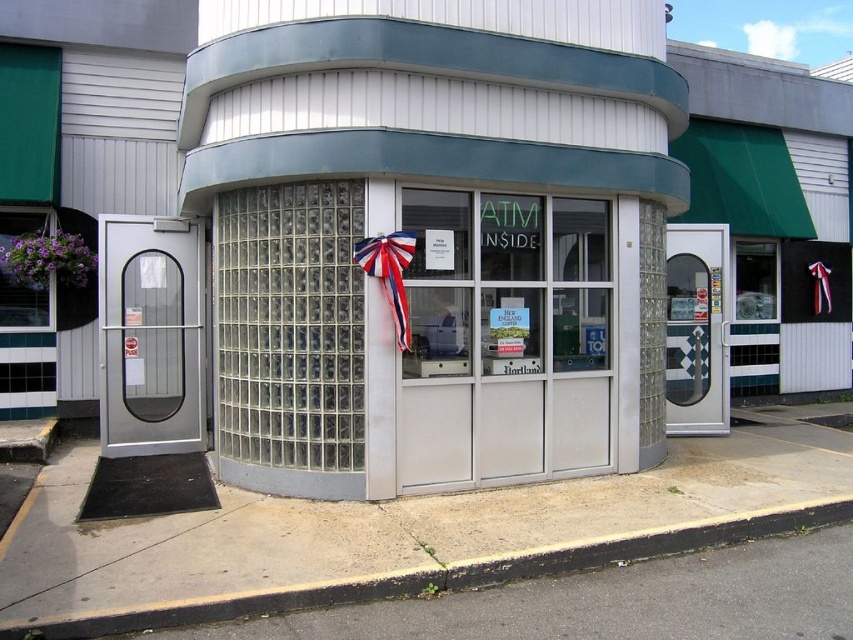
Question: Which object appears farthest from the camera in this image?

Choices:
 (A) clear glass atm at center
 (B) red fabric bow at center

Answer: (B)

Question: Observing the image, what is the correct spatial positioning of clear glass atm at center in reference to red fabric bow at center?

Choices:
 (A) above
 (B) below

Answer: (A)

Question: Which of the following is the farthest from the observer?

Choices:
 (A) (376, 259)
 (B) (248, 355)

Answer: (B)

Question: Does clear glass atm at center appear on the right side of red fabric bow at center?

Choices:
 (A) yes
 (B) no

Answer: (A)

Question: Can you confirm if clear glass atm at center is thinner than red fabric bow at center?

Choices:
 (A) no
 (B) yes

Answer: (A)

Question: Among these objects, which one is farthest from the camera?

Choices:
 (A) clear glass atm at center
 (B) red fabric bow at center

Answer: (B)